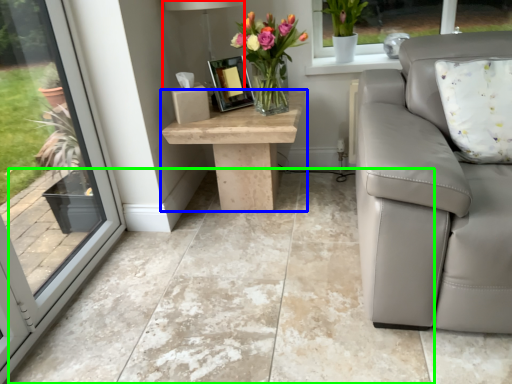
Question: Estimate the real-world distances between objects in this image. Which object is farther from lamp (highlighted by a red box), table (highlighted by a blue box) or concrete (highlighted by a green box)?

Choices:
 (A) table
 (B) concrete

Answer: (B)